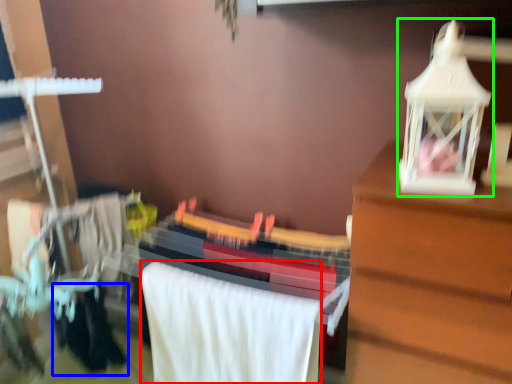
Question: Which object is positioned closest to bath towel (highlighted by a red box)? Select from clothing (highlighted by a blue box) and toy (highlighted by a green box).

Choices:
 (A) clothing
 (B) toy

Answer: (A)